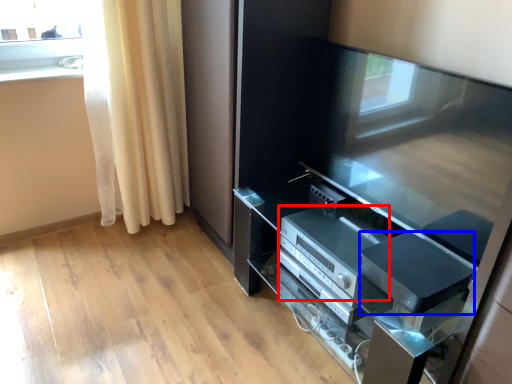
Question: Among these objects, which one is farthest to the camera, appliance (highlighted by a red box) or appliance (highlighted by a blue box)?

Choices:
 (A) appliance
 (B) appliance

Answer: (A)